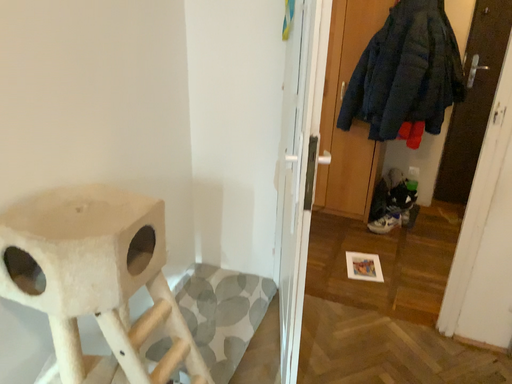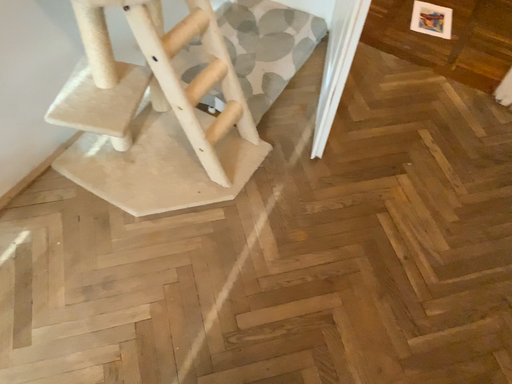
Question: Which way did the camera rotate in the video?

Choices:
 (A) rotated downward
 (B) rotated upward

Answer: (A)